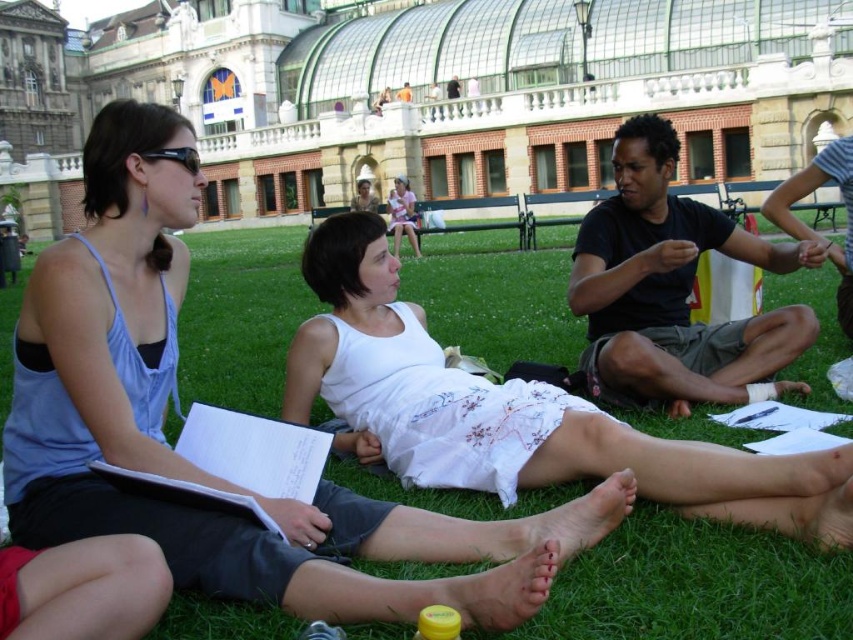
You are a photographer trying to capture a candid shot of the two women on the grass. You notice the dark brown leather jacket at right and the smooth skin foot at lower center in your frame. Which object is wider in the image?

The dark brown leather jacket at right is wider than the smooth skin foot at lower center.

You are a photographer standing at the park entrance and want to take a photo of the matte blue tank top at left. What coordinates should you aim for to capture it?

You should aim for coordinates point (166, 406) to capture the matte blue tank top at left.